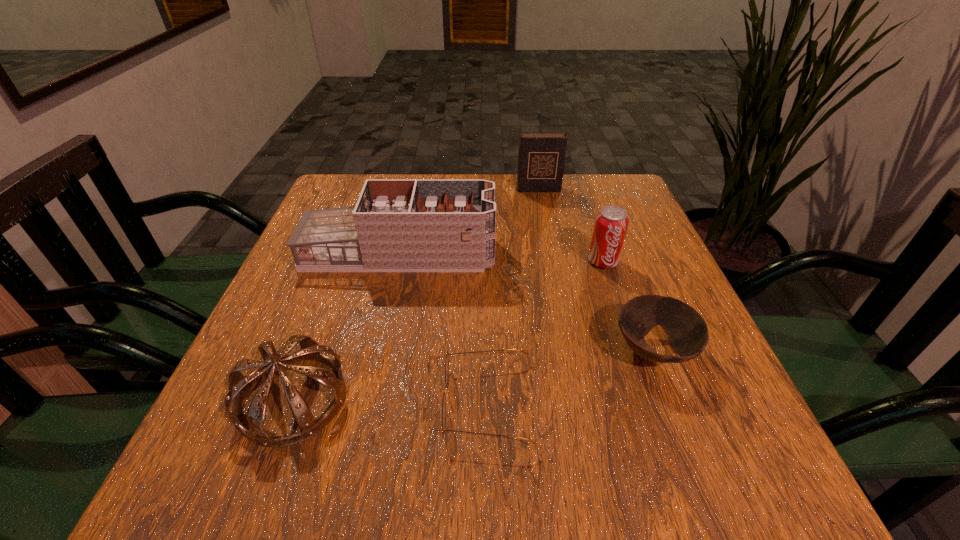
Locate which object ranks in proximity to the tiara. Please provide its 2D coordinates. Your answer should be formatted as a tuple, i.e. [(x, y)], where the tuple contains the x and y coordinates of a point satisfying the conditions above.

[(446, 368)]

Where is `object that is the fourth closest to the dollhouse`? object that is the fourth closest to the dollhouse is located at coordinates (446, 368).

You are a GUI agent. You are given a task and a screenshot of the screen. Output one action in this format:
    pyautogui.click(x=<x>, y=<y>)
    Task: Click on the vacant space that satisfies the following two spatial constraints: 1. on the back side of the bowl; 2. on the right side of the tiara
    Image resolution: width=960 pixels, height=540 pixels.
    Given the screenshot: What is the action you would take?
    pyautogui.click(x=310, y=352)

In order to click on free space in the image that satisfies the following two spatial constraints: 1. on the front cover of the diary; 2. at the entrance of the dollhouse in this screenshot , I will do `click(551, 254)`.

Identify the location of vacant space that satisfies the following two spatial constraints: 1. on the front cover of the fourth object from left to right; 2. at the entrance of the dollhouse. (551, 254).

At what (x,y) coordinates should I click in order to perform the action: click on free spot that satisfies the following two spatial constraints: 1. on the front cover of the bowl; 2. on the right side of the third object from right to left. Please return your answer as a coordinate pair (x, y). Looking at the image, I should click on (570, 352).

Locate an element on the screen. The image size is (960, 540). vacant space that satisfies the following two spatial constraints: 1. on the front cover of the farthest object; 2. at the entrance of the dollhouse is located at coordinates (551, 254).